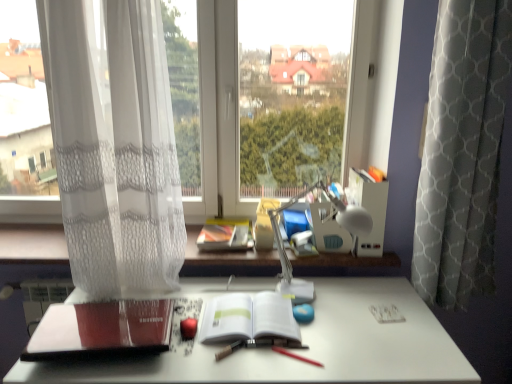
Find the location of a particular element. vacant space in front of white plastic table lamp at center is located at coordinates (337, 345).